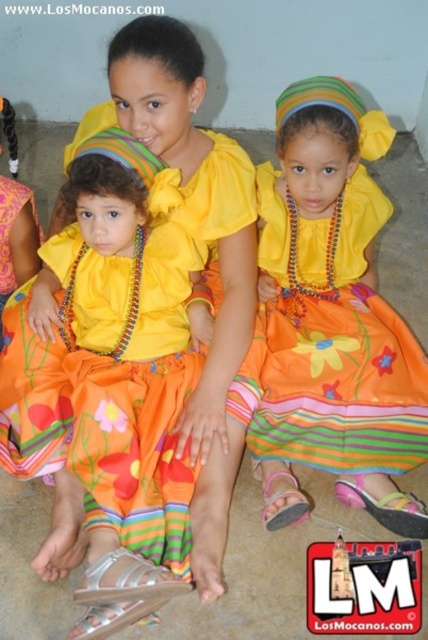
Question: Which point is closer to the camera taking this photo?

Choices:
 (A) (360, 113)
 (B) (112, 300)

Answer: (A)

Question: Does matte yellow blouse at center come in front of matte orange dress at center?

Choices:
 (A) yes
 (B) no

Answer: (A)

Question: Is matte yellow blouse at center below matte orange dress at center?

Choices:
 (A) no
 (B) yes

Answer: (B)

Question: Can you confirm if matte yellow blouse at center is positioned below matte orange dress at center?

Choices:
 (A) yes
 (B) no

Answer: (A)

Question: Which object appears closest to the camera in this image?

Choices:
 (A) matte yellow blouse at center
 (B) matte orange dress at center

Answer: (A)